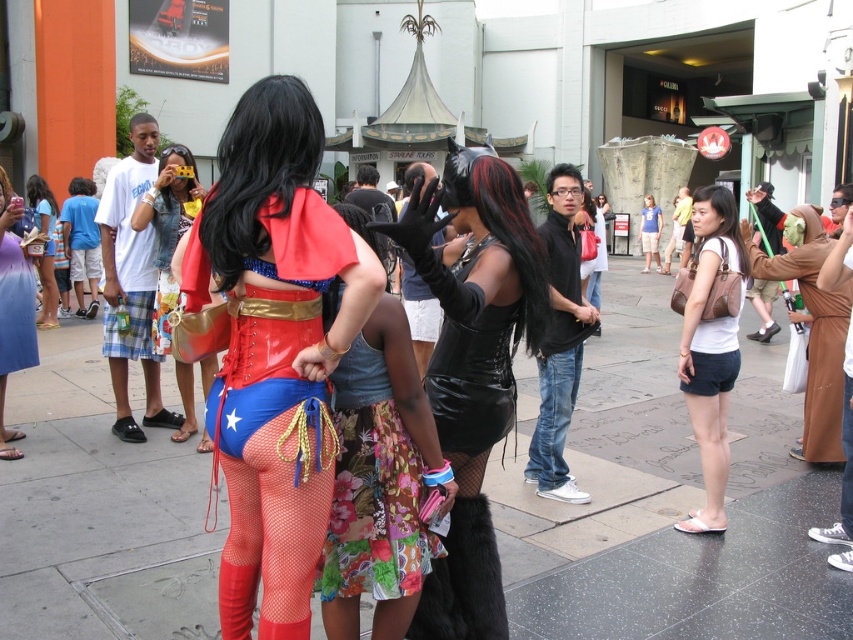
Can you confirm if shiny black corset at center is positioned below floral denim skirt at center?

Actually, shiny black corset at center is above floral denim skirt at center.

Is shiny black corset at center shorter than floral denim skirt at center?

No, shiny black corset at center is not shorter than floral denim skirt at center.

Where is `shiny black corset at center`? The image size is (853, 640). shiny black corset at center is located at coordinates (473, 365).

Identify the location of shiny black corset at center. The height and width of the screenshot is (640, 853). (473, 365).

Is point (375, 531) positioned after point (721, 330)?

No, it is in front of (721, 330).

In the scene shown: Who is more forward, (357, 442) or (729, 257)?

Point (357, 442) is in front.

The width and height of the screenshot is (853, 640). What are the coordinates of `floral denim skirt at center` in the screenshot? It's located at (378, 481).

Between matte purple skirt at lower left and matte brown purse at left, which one appears on the right side from the viewer's perspective?

Positioned to the right is matte purple skirt at lower left.

In the scene shown: Does matte purple skirt at lower left appear on the right side of matte brown purse at left?

Indeed, matte purple skirt at lower left is positioned on the right side of matte brown purse at left.

Is point (9, 220) positioned before point (55, 296)?

That is True.

This screenshot has height=640, width=853. In order to click on matte purple skirt at lower left in this screenshot , I will do `click(13, 310)`.